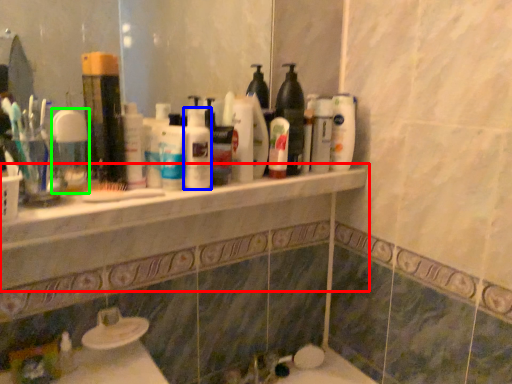
Question: Estimate the real-world distances between objects in this image. Which object is farther from counter top (highlighted by a red box), cleaning product (highlighted by a blue box) or mouthwash (highlighted by a green box)?

Choices:
 (A) cleaning product
 (B) mouthwash

Answer: (B)